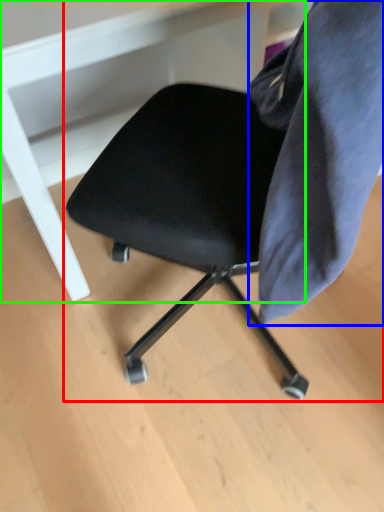
Question: Which object is positioned farthest from chair (highlighted by a red box)? Select from fabric (highlighted by a blue box) and vanity (highlighted by a green box).

Choices:
 (A) fabric
 (B) vanity

Answer: (B)